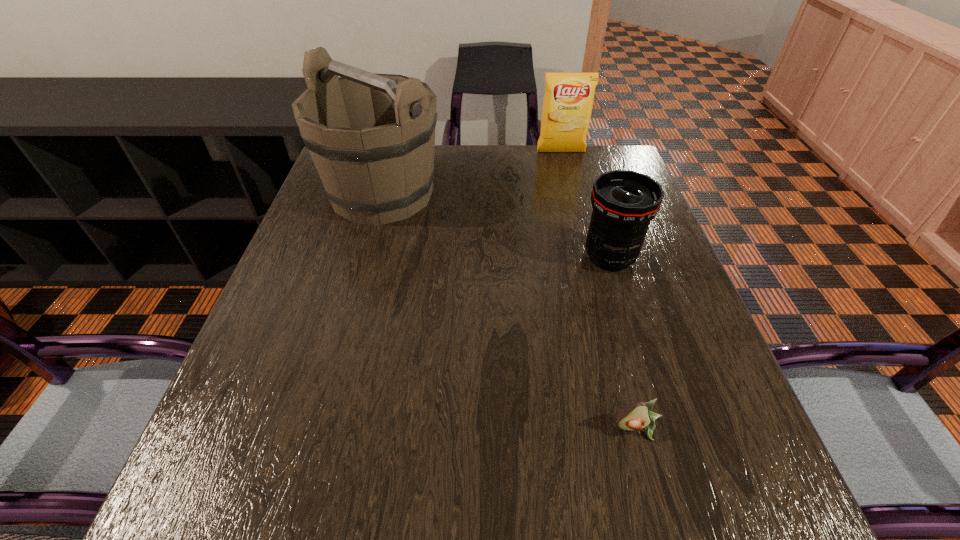
Identify the location of the tallest object. (371, 136).

Locate an element on the screen. The width and height of the screenshot is (960, 540). the leftmost object is located at coordinates (371, 136).

Identify the location of the third shortest object. coord(567,104).

Identify the location of crisp (potato chip). (567, 104).

Where is `the second nearest object`? This screenshot has width=960, height=540. the second nearest object is located at coordinates (624, 202).

Locate an element on the screen. the third tallest object is located at coordinates (624, 202).

Locate an element on the screen. Image resolution: width=960 pixels, height=540 pixels. avocado is located at coordinates (636, 416).

Identify the location of the nearest object. This screenshot has height=540, width=960. (636, 416).

At what (x,y) coordinates should I click in order to perform the action: click on vacant area situated 0.100m on the front of the bucket. Please return your answer as a coordinate pair (x, y). Image resolution: width=960 pixels, height=540 pixels. Looking at the image, I should click on (364, 260).

Identify the location of free point located 0.360m on the front of the third shortest object with the logo. point(582,232).